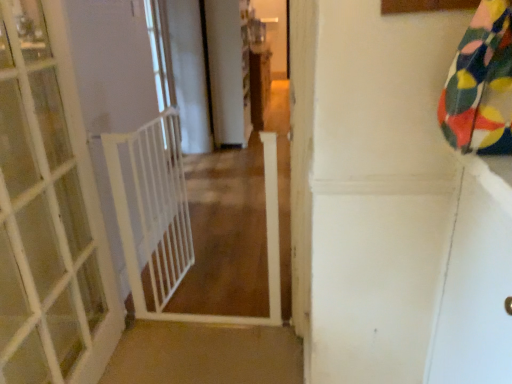
Question: Is point (159, 49) positioned closer to the camera than point (496, 344)?

Choices:
 (A) closer
 (B) farther

Answer: (B)

Question: Considering the positions of white plastic gate at left and white glossy screen door at upper right in the image, is white plastic gate at left bigger or smaller than white glossy screen door at upper right?

Choices:
 (A) big
 (B) small

Answer: (A)

Question: Which is farther from the white glossy screen door at upper right?

Choices:
 (A) white plastic gate at left
 (B) white plastic balustrade at left
 (C) white wooden door at left
 (D) white plastic gate at center

Answer: (A)

Question: Which is nearer to the white plastic gate at center?

Choices:
 (A) white wooden door at left
 (B) white plastic gate at left
 (C) white glossy screen door at upper right
 (D) white plastic balustrade at left

Answer: (D)